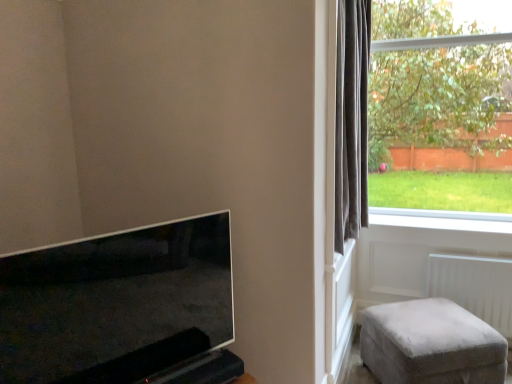
Where is `blank space situated above white smooth window sill at lower right (from a real-world perspective)`? blank space situated above white smooth window sill at lower right (from a real-world perspective) is located at coordinates (440, 226).